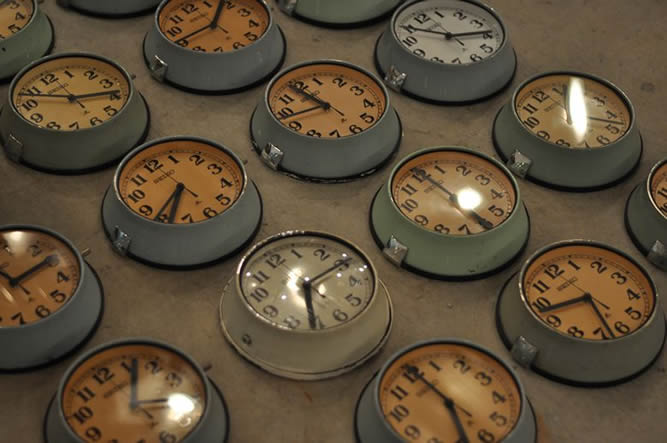
Image resolution: width=667 pixels, height=443 pixels. What are the coordinates of `clock 1` in the screenshot? It's located at (474, 374).